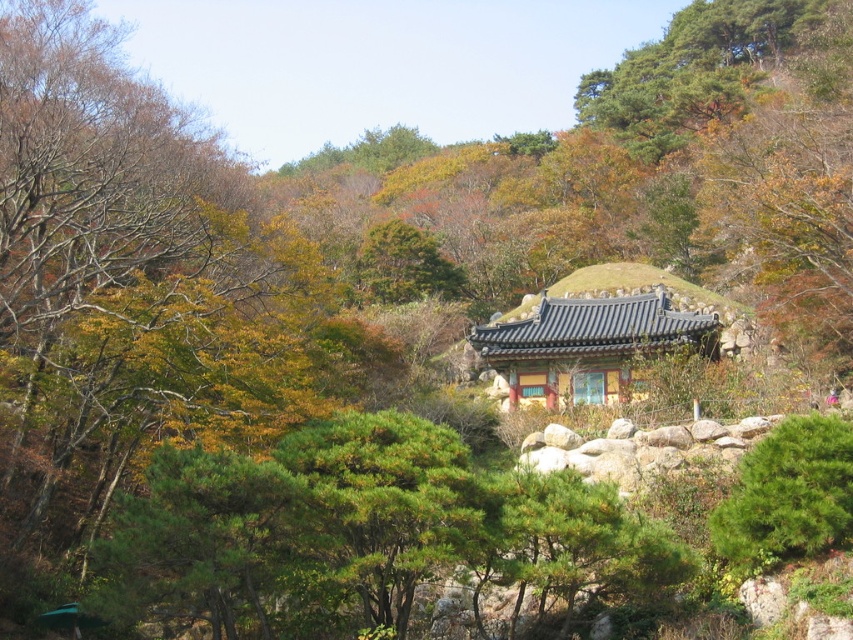
In the scene shown: You are an architect visiting a forest temple site. You see the yellowish wood temple at center and the green matte tree at center. Which one is more to the left?

The yellowish wood temple at center is more to the left because it is positioned on the left side of the green matte tree at center.

You are an architect visiting a forest temple. You notice the yellowish wood temple at center and the green matte tree at center. Which object is closer to you from your current viewpoint?

The yellowish wood temple at center is closer because the green matte tree at center is positioned behind it.